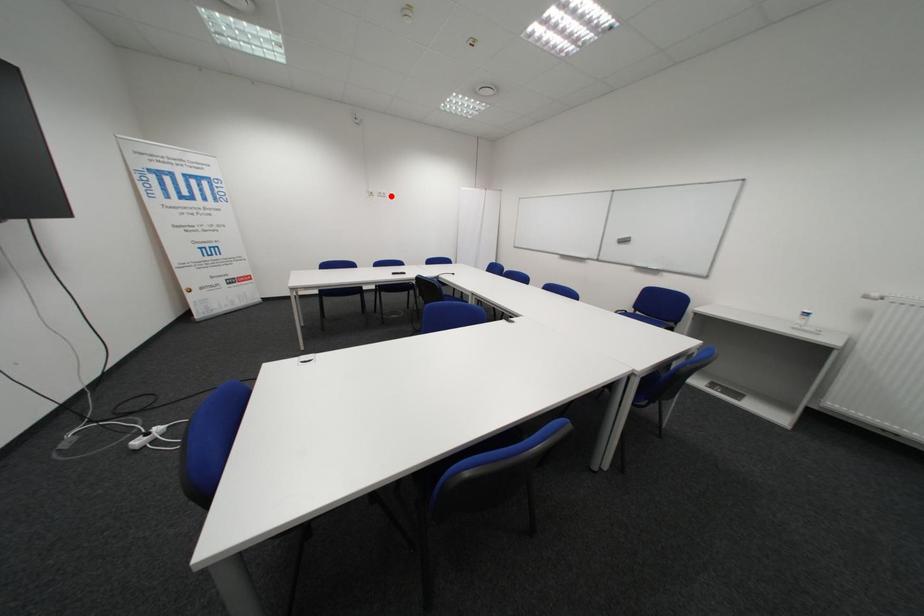
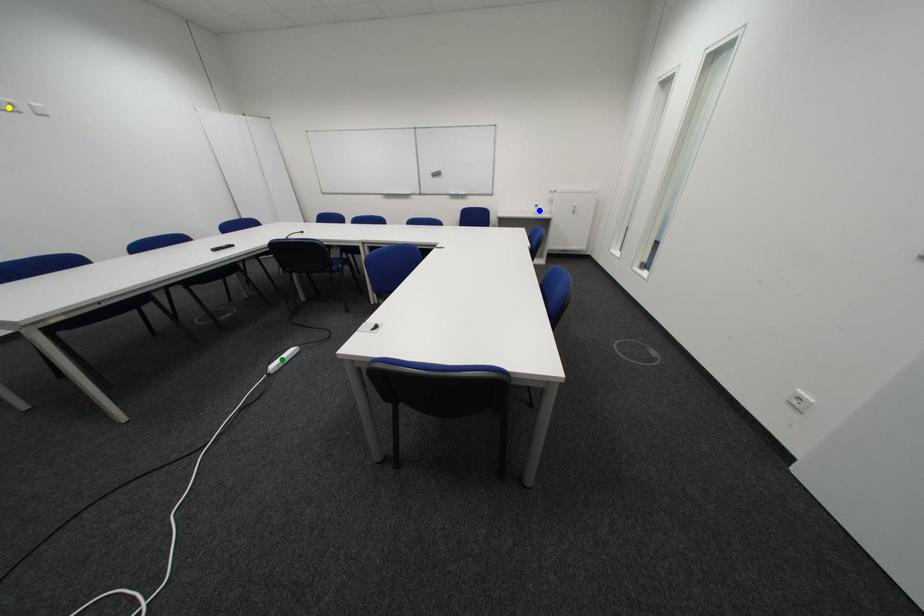
Question: I am providing you with two images of the same scene from different viewpoints. A red point is marked on the first image. You are given multiple points on the second image. Which point in image 2 represents the same 3d spot as the red point in image 1?

Choices:
 (A) green point
 (B) blue point
 (C) yellow point

Answer: (C)